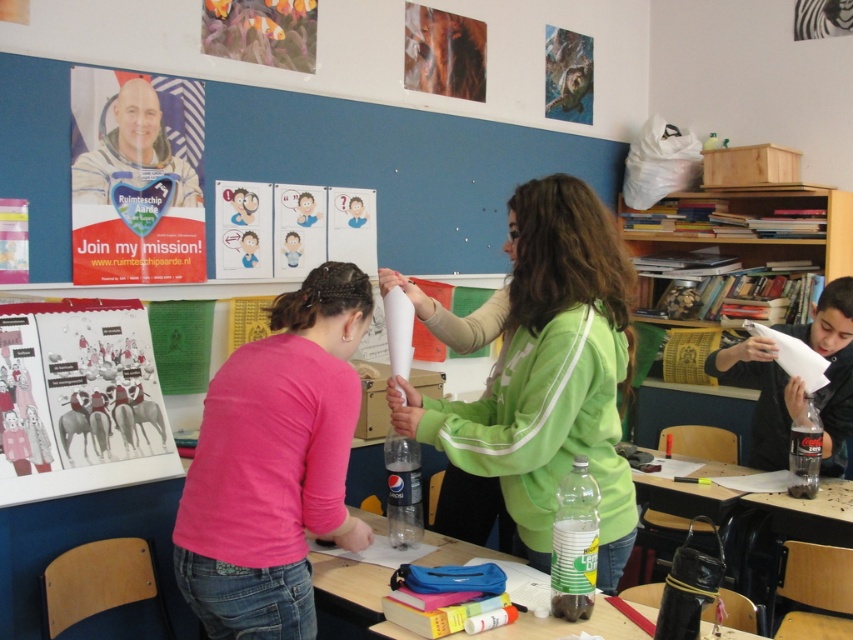
You are a student in the classroom. You notice the matte green sweatshirt at center and the matte paper poster at upper left. Which object is taller?

The matte green sweatshirt at center is taller than the matte paper poster at upper left.

You are a student in the classroom and need to choose between the translucent plastic bottle at center and the space suit astronaut at upper left for a project. Which object is shorter?

The translucent plastic bottle at center is shorter than the space suit astronaut at upper left.